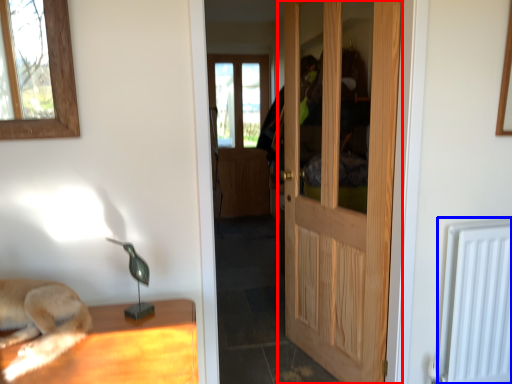
Question: Which object appears farthest to the camera in this image, door (highlighted by a red box) or radiator (highlighted by a blue box)?

Choices:
 (A) door
 (B) radiator

Answer: (B)